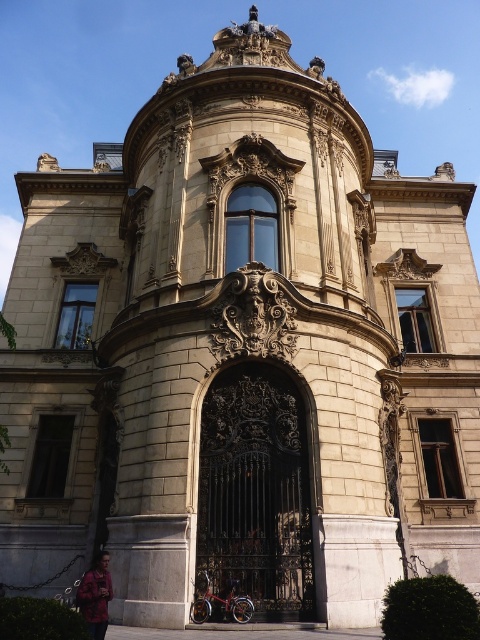
You are standing in front of the grand ornate building. There is a point marked at coordinates (255, 492). What does this point indicate?

The point at coordinates (255, 492) marks the location of the black wrought iron gate at center.

You are a visitor standing in front of the grand building and see the black wrought iron gate at center and the red cotton jacket at lower left. Which object is taller?

The black wrought iron gate at center is taller than the red cotton jacket at lower left.